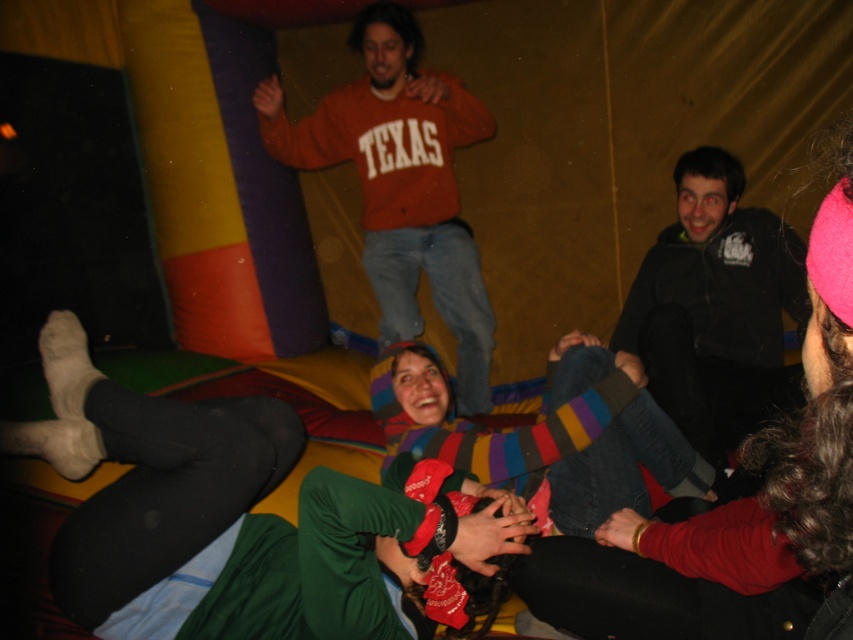
You are a photographer inside the bouncy castle and want to take a photo of both the striped sweater at center and the black soft jacket at upper right. Which one is lower in the image?

The striped sweater at center is positioned under the black soft jacket at upper right, so the striped sweater at center is lower in the image.